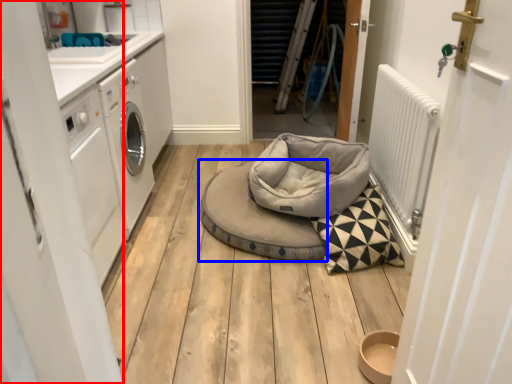
Question: Which object appears closest to the camera in this image, door (highlighted by a red box) or dog bed (highlighted by a blue box)?

Choices:
 (A) door
 (B) dog bed

Answer: (A)